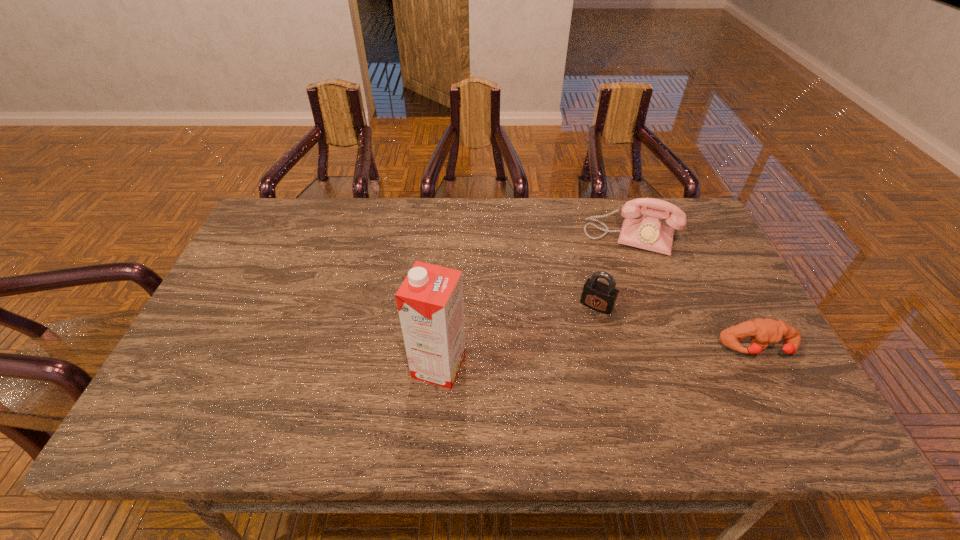
You are a GUI agent. You are given a task and a screenshot of the screen. Output one action in this format:
    pyautogui.click(x=<x>, y=<y>)
    Task: Click on the vacant space on the desktop that is between the carton and the shortest object and is positioned on the dial of the telephone
    
    Given the screenshot: What is the action you would take?
    pyautogui.click(x=601, y=357)

Locate an element on the screen. This screenshot has width=960, height=540. vacant space on the desktop that is between the leftmost object and the puncher and is positioned on the front of the padlock near the keyhole is located at coordinates [x=566, y=359].